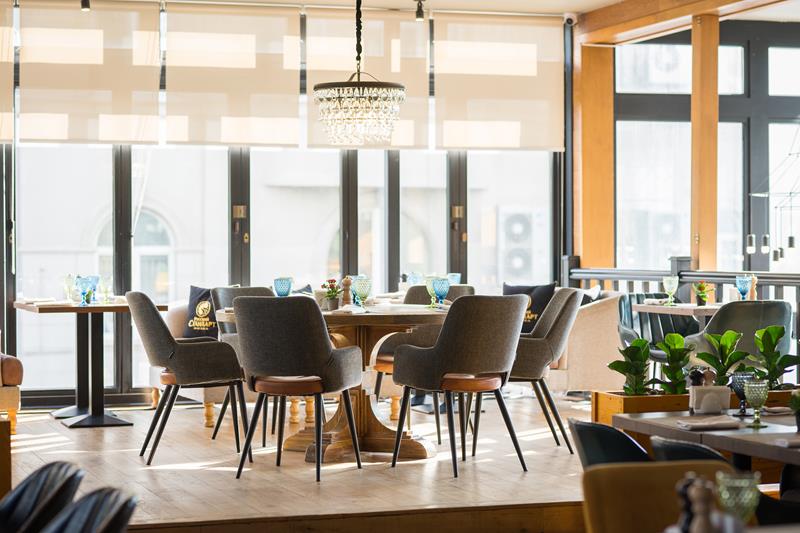
Where is `door hardware`? Image resolution: width=800 pixels, height=533 pixels. door hardware is located at coordinates (242, 214), (457, 209), (457, 222), (234, 231), (246, 234), (462, 237).